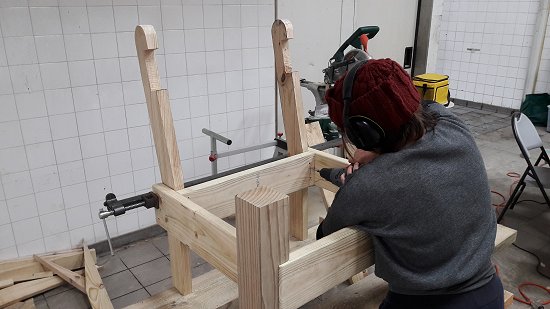
The image size is (550, 309). Identify the location of white door. (395, 61).